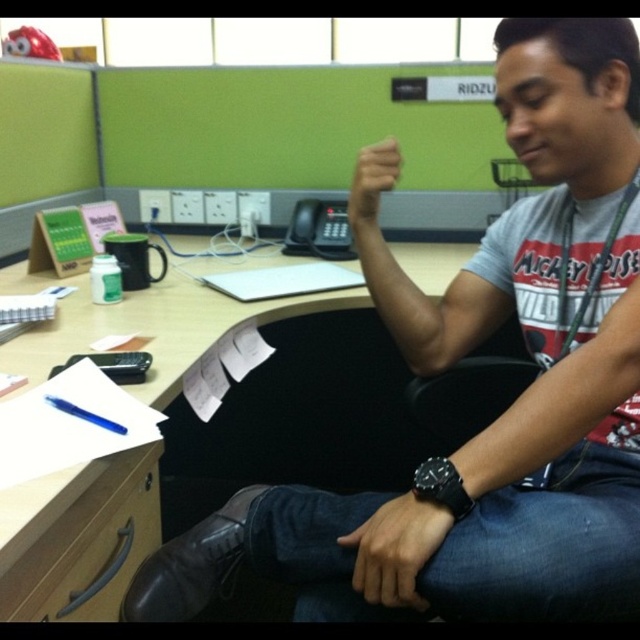
You are standing in front of the desk and want to reach the point at coordinates (104, 528). Considering your arm can extend 30 inches, can you reach it without moving your feet?

The point at coordinates (104, 528) is 33.83 inches away from the viewer, which is beyond the 30 inches reach of your arm. Therefore, you cannot reach it without moving your feet.

You are organizing the desk items and need to place the wooden at lower left and the blue plastic pen at lower left into a drawer. Which item requires a wider space to fit properly?

The blue plastic pen at lower left requires a wider space because its width is greater than the wooden at lower left.

You are an office worker who needs to reach for the blue plastic pen at lower left while keeping your hand on the matte skin hand at center. Can you reach it without moving your hand?

The matte skin hand at center is further to the viewer than the blue plastic pen at lower left, so the pen is closer to you. Since your hand is already extended forward, you can reach the blue plastic pen at lower left without moving your hand.